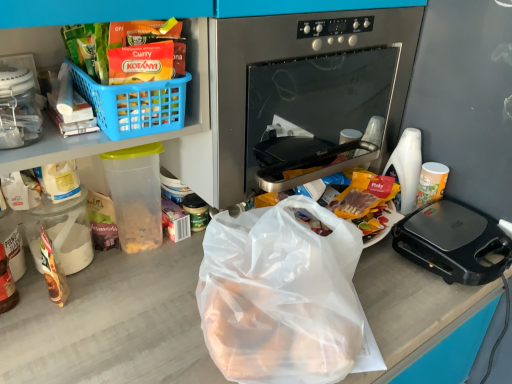
Question: Is blue plastic basket at upper left outside stainless steel oven at center?

Choices:
 (A) no
 (B) yes

Answer: (B)

Question: From the image's perspective, is blue plastic basket at upper left on top of stainless steel oven at center?

Choices:
 (A) yes
 (B) no

Answer: (B)

Question: Can you confirm if blue plastic basket at upper left is taller than stainless steel oven at center?

Choices:
 (A) no
 (B) yes

Answer: (A)

Question: Can stainless steel oven at center be found inside blue plastic basket at upper left?

Choices:
 (A) yes
 (B) no

Answer: (B)

Question: Could you tell me if blue plastic basket at upper left is facing stainless steel oven at center?

Choices:
 (A) no
 (B) yes

Answer: (A)

Question: Would you say white glossy cup at right, marked as the first coffee cup in a right-to-left arrangement, is to the left or to the right of stainless steel oven at center in the picture?

Choices:
 (A) right
 (B) left

Answer: (A)

Question: In terms of width, does white glossy cup at right, which ranks as the second coffee cup in left-to-right order, look wider or thinner when compared to stainless steel oven at center?

Choices:
 (A) thin
 (B) wide

Answer: (A)

Question: Looking at the image, does white glossy cup at right, which ranks as the second coffee cup in left-to-right order, seem bigger or smaller compared to stainless steel oven at center?

Choices:
 (A) small
 (B) big

Answer: (A)

Question: In terms of height, does white glossy cup at right, marked as the first coffee cup in a right-to-left arrangement, look taller or shorter compared to stainless steel oven at center?

Choices:
 (A) short
 (B) tall

Answer: (A)

Question: From the image's perspective, relative to black plastic sandwich maker at right, is stainless steel oven at center above or below?

Choices:
 (A) above
 (B) below

Answer: (A)

Question: Considering the positions of stainless steel oven at center and black plastic sandwich maker at right in the image, is stainless steel oven at center taller or shorter than black plastic sandwich maker at right?

Choices:
 (A) tall
 (B) short

Answer: (A)

Question: In the image, is stainless steel oven at center positioned in front of or behind black plastic sandwich maker at right?

Choices:
 (A) front
 (B) behind

Answer: (A)

Question: Looking at their shapes, would you say stainless steel oven at center is wider or thinner than black plastic sandwich maker at right?

Choices:
 (A) thin
 (B) wide

Answer: (B)

Question: Is black plastic sandwich maker at right inside or outside of white plastic cup at right, which is the second coffee cup from right to left?

Choices:
 (A) inside
 (B) outside

Answer: (B)

Question: From the image's perspective, is black plastic sandwich maker at right above or below white plastic cup at right, which ranks as the 1th coffee cup in left-to-right order?

Choices:
 (A) below
 (B) above

Answer: (A)